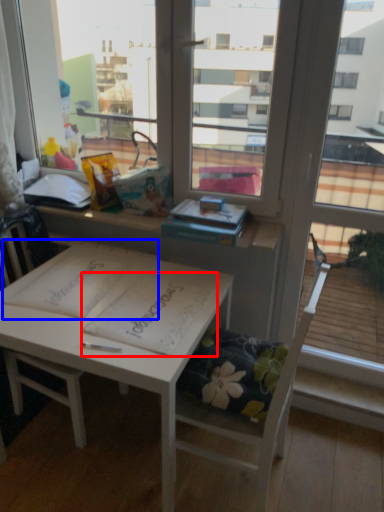
Question: Which object appears closest to the camera in this image, notebook (highlighted by a red box) or notebook (highlighted by a blue box)?

Choices:
 (A) notebook
 (B) notebook

Answer: (A)